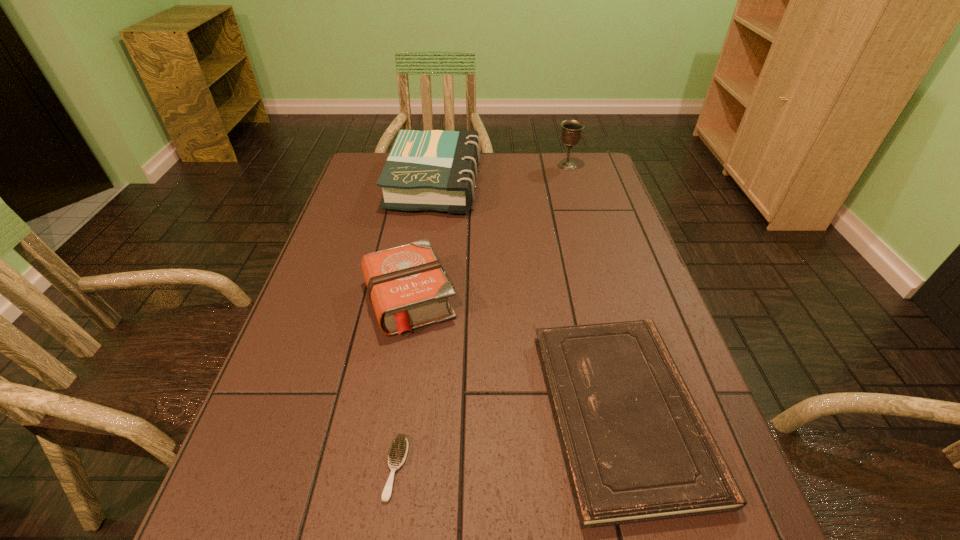
Where is `vacant space at the far edge of the desktop`? This screenshot has height=540, width=960. vacant space at the far edge of the desktop is located at coordinates (533, 168).

Locate an element on the screen. This screenshot has height=540, width=960. free space at the left edge is located at coordinates (234, 501).

You are a GUI agent. You are given a task and a screenshot of the screen. Output one action in this format:
    pyautogui.click(x=<x>, y=<y>)
    Task: Click on the free space at the right edge
    The height and width of the screenshot is (540, 960).
    Given the screenshot: What is the action you would take?
    pyautogui.click(x=576, y=225)

The height and width of the screenshot is (540, 960). In order to click on vacant space at the far right corner of the desktop in this screenshot , I will do `click(608, 179)`.

Identify the location of free space that is in between the chalice and the left paperback book. (501, 174).

At what (x,y) coordinates should I click in order to perform the action: click on unoccupied position between the left paperback book and the chalice. Please return your answer as a coordinate pair (x, y). Looking at the image, I should click on (501, 174).

Where is `free point between the farther paperback book and the nearer paperback book`? The width and height of the screenshot is (960, 540). free point between the farther paperback book and the nearer paperback book is located at coordinates (529, 298).

The width and height of the screenshot is (960, 540). In order to click on empty space that is in between the Bible and the tallest object in this screenshot , I will do `click(488, 232)`.

Where is `empty space that is in between the Bible and the right paperback book`? This screenshot has width=960, height=540. empty space that is in between the Bible and the right paperback book is located at coordinates (516, 355).

What are the coordinates of `empty location between the taller paperback book and the right paperback book` in the screenshot? It's located at (529, 298).